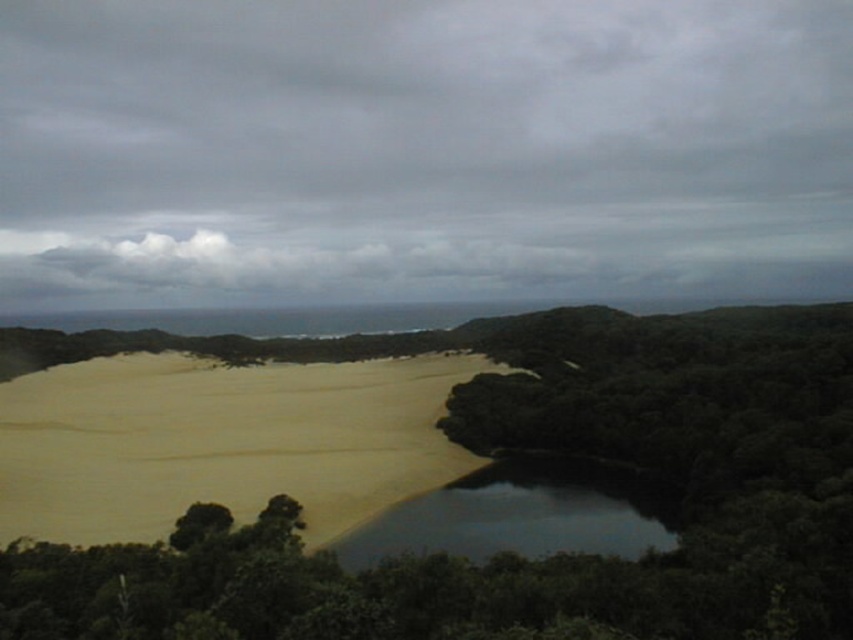
You are standing at the point marked by the coordinates point (221, 442) in the image. Based on the scene description, what type of terrain would you expect to find under your feet?

The point (221, 442) corresponds to sandy yellow at lower left, so you would be standing on sand.

You are standing at the edge of the sandy yellow at lower left and want to reach the dark reflective water at center. Which direction should you move to get there?

You should move to the right towards the dark reflective water at center since the sandy yellow at lower left is to the left of it.